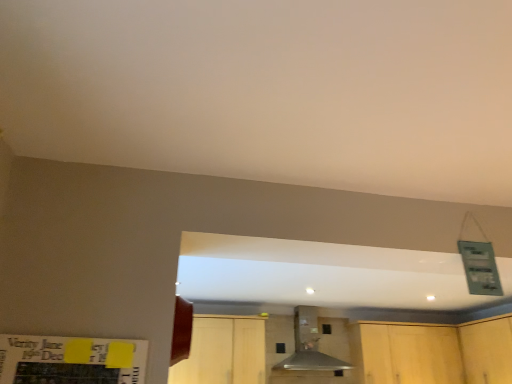
Question: Considering the positions of light wood cabinetry at lower right, arranged as the 2th cabinetry when viewed from the left, and light wood cabinet at lower center, which ranks as the 3th cabinetry in right-to-left order, in the image, is light wood cabinetry at lower right, arranged as the 2th cabinetry when viewed from the left, wider or thinner than light wood cabinet at lower center, which ranks as the 3th cabinetry in right-to-left order,?

Choices:
 (A) wide
 (B) thin

Answer: (A)

Question: From the image's perspective, relative to light wood cabinet at lower center, which ranks as the 3th cabinetry in right-to-left order, is light wood cabinetry at lower right, arranged as the 2th cabinetry when viewed from the left, above or below?

Choices:
 (A) above
 (B) below

Answer: (B)

Question: Based on their relative distances, which object is farther from the metallic gray vent at center?

Choices:
 (A) light wood cabinet at lower center, which ranks as the 3th cabinetry in right-to-left order
 (B) light wood cabinetry at lower right, the second cabinetry viewed from the right
 (C) wooden cabinet at lower right, which ranks as the 3th cabinetry in left-to-right order

Answer: (C)

Question: Estimate the real-world distances between objects in this image. Which object is farther from the metallic gray vent at center?

Choices:
 (A) wooden cabinet at lower right, the 1th cabinetry in the right-to-left sequence
 (B) light wood cabinet at lower center, which is the 1th cabinetry in left-to-right order
 (C) light wood cabinetry at lower right, arranged as the 2th cabinetry when viewed from the left

Answer: (A)